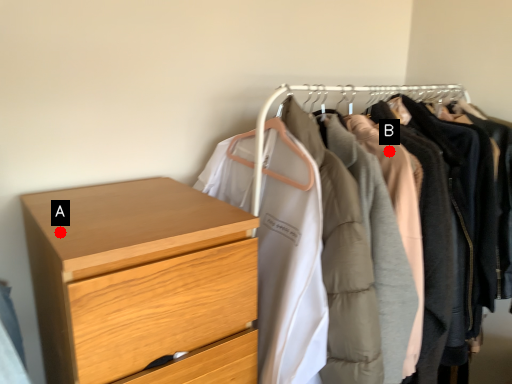
Question: Two points are circled on the image, labeled by A and B beside each circle. Which point is further to the camera?

Choices:
 (A) A is further
 (B) B is further

Answer: (B)